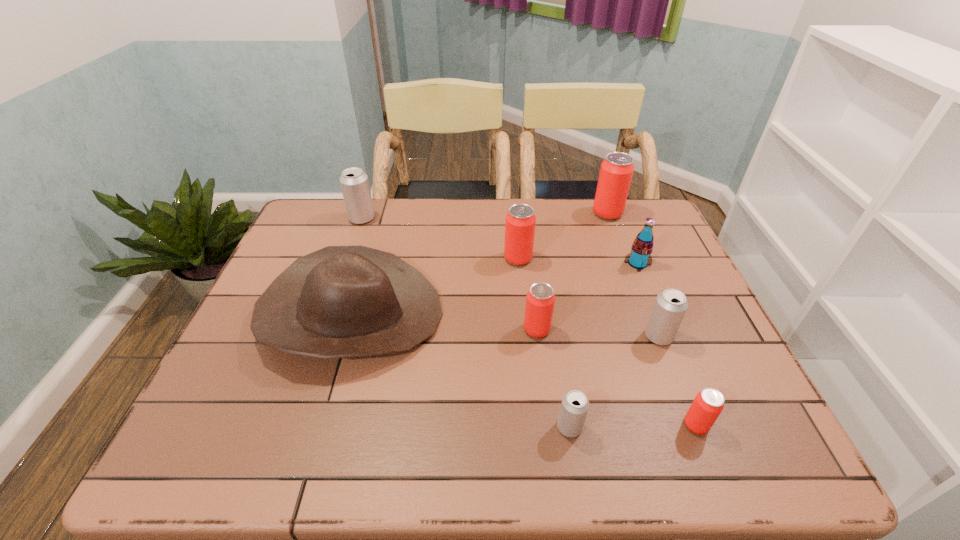
You are a GUI agent. You are given a task and a screenshot of the screen. Output one action in this format:
    pyautogui.click(x=<x>, y=<y>)
    Task: Click on the free spot at the near edge of the desktop
    Image resolution: width=960 pixels, height=540 pixels.
    Given the screenshot: What is the action you would take?
    pyautogui.click(x=439, y=466)

Identify the location of vacant space at the right edge. This screenshot has width=960, height=540. (677, 343).

I want to click on free space at the far left corner, so click(337, 202).

The height and width of the screenshot is (540, 960). What are the coordinates of `vacant space at the near left corner of the desktop` in the screenshot? It's located at (264, 432).

The width and height of the screenshot is (960, 540). Identify the location of blank area at the near right corner. (727, 429).

At what (x,y) coordinates should I click in order to perform the action: click on blank region between the brown cowboy hat and the third biggest red beer can. Please return your answer as a coordinate pair (x, y). This screenshot has height=540, width=960. Looking at the image, I should click on (444, 322).

Locate an element on the screen. Image resolution: width=960 pixels, height=540 pixels. vacant space that's between the third nearest red beer can and the second farthest white beer can is located at coordinates (588, 298).

Identify the location of unoccupied position between the farthest red beer can and the second smallest white beer can. (633, 275).

Locate an element on the screen. The height and width of the screenshot is (540, 960). free point between the second biggest red beer can and the tallest object is located at coordinates (563, 236).

The height and width of the screenshot is (540, 960). In order to click on blank region between the third biggest red beer can and the smallest red beer can in this screenshot , I will do `click(616, 377)`.